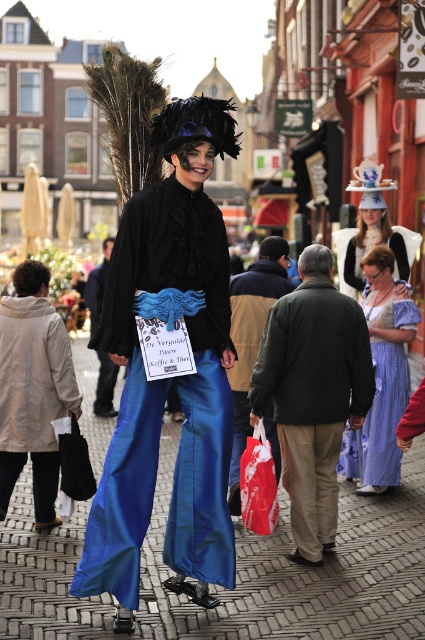
Question: Among these objects, which one is farthest from the camera?

Choices:
 (A) red plastic bag at lower center
 (B) dark brown leather jacket at center
 (C) matte beige coat at lower left

Answer: (C)

Question: Is matte beige coat at lower left positioned before blue gingham dress at center?

Choices:
 (A) yes
 (B) no

Answer: (A)

Question: Which of these objects is positioned farthest from the matte black shirt at center?

Choices:
 (A) dark brown leather jacket at center
 (B) red plastic bag at lower center
 (C) blue gingham dress at center
 (D) matte beige coat at lower left

Answer: (C)

Question: Can you confirm if matte black shirt at center is thinner than dark green jacket at center?

Choices:
 (A) no
 (B) yes

Answer: (A)

Question: Which of the following is the farthest from the observer?

Choices:
 (A) (101, 324)
 (B) (268, 525)
 (C) (99, 305)

Answer: (C)

Question: Is dark brown leather jacket at center positioned in front of red plastic bag at lower center?

Choices:
 (A) yes
 (B) no

Answer: (A)